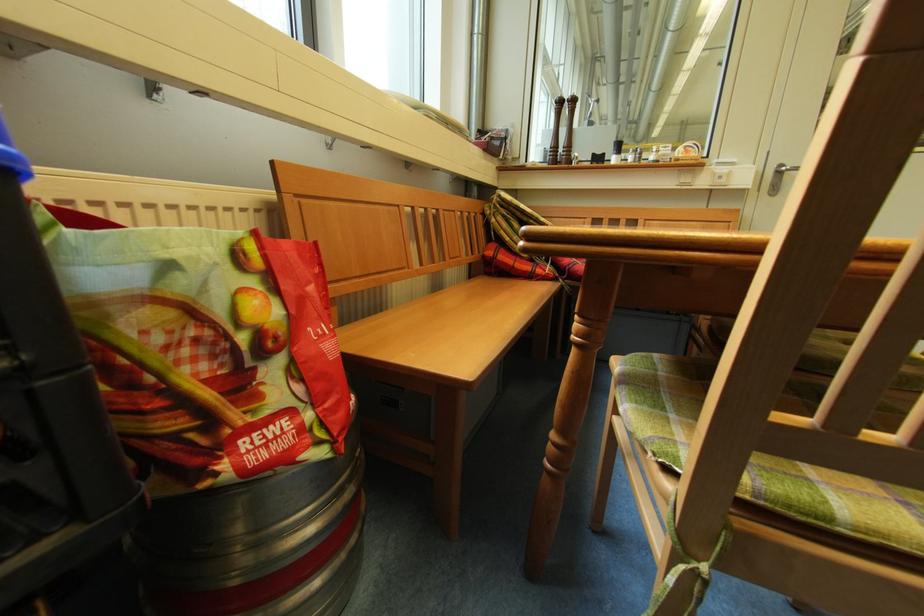
Locate an element on the screen. dark wooden grinder is located at coordinates coord(553,139).